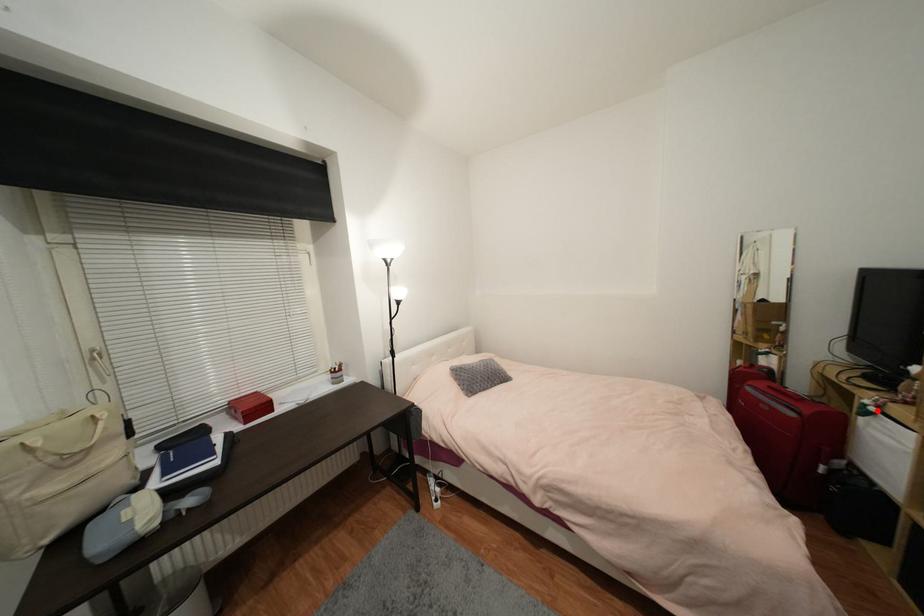
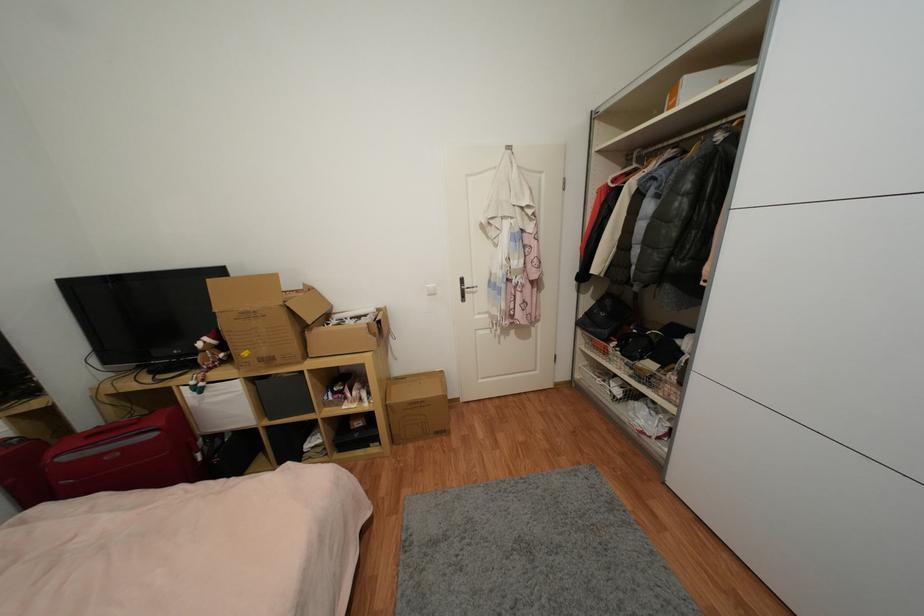
Question: I am providing you with two images of the same scene from different viewpoints. In image1, a red point is highlighted. Considering the same 3D point in image2, which of the following is correct?

Choices:
 (A) It is closer
 (B) It is farther

Answer: (A)